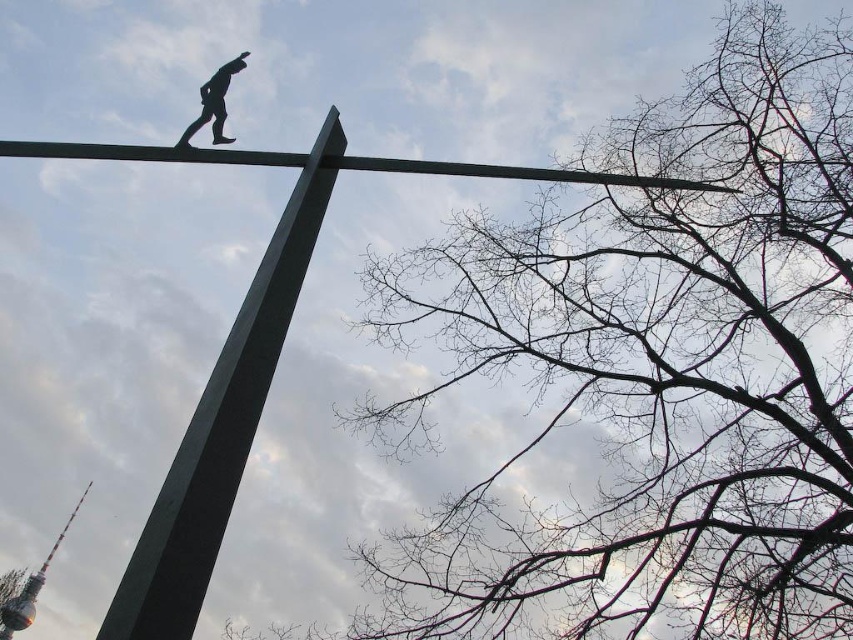
Question: Is green polished metal pole at upper center thinner than black matte figure at upper center?

Choices:
 (A) yes
 (B) no

Answer: (B)

Question: Which object appears closest to the camera in this image?

Choices:
 (A) black matte figure at upper center
 (B) green polished metal pole at upper center

Answer: (B)

Question: Does green polished metal pole at upper center appear over black matte figure at upper center?

Choices:
 (A) no
 (B) yes

Answer: (A)

Question: Is green polished metal pole at upper center above black matte figure at upper center?

Choices:
 (A) no
 (B) yes

Answer: (A)

Question: Which point is farther to the camera?

Choices:
 (A) (204, 102)
 (B) (308, 259)

Answer: (A)